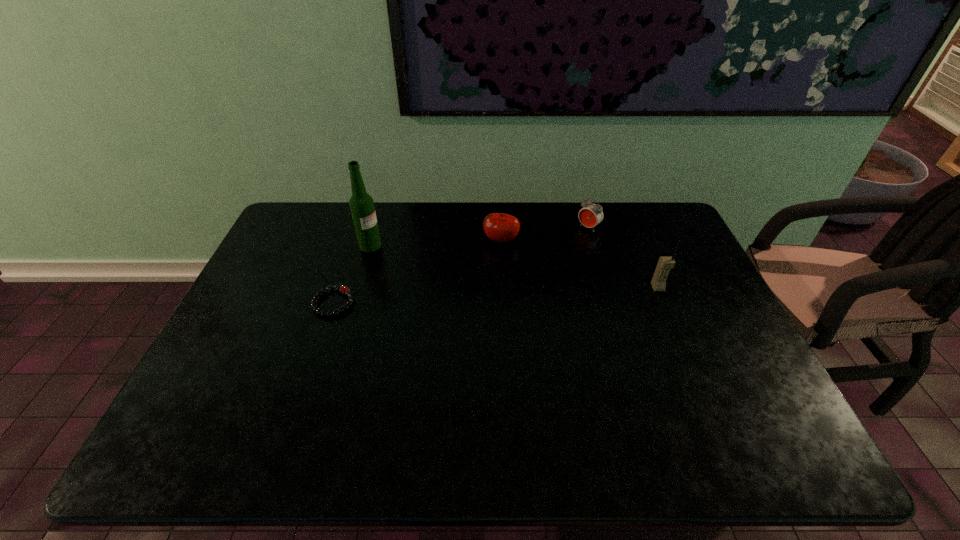
This screenshot has width=960, height=540. Identify the location of vacant area situated 0.070m on the face of the second object from right to left. (571, 242).

Where is `vacant space located on the stem of the apple`? This screenshot has height=540, width=960. vacant space located on the stem of the apple is located at coordinates (491, 260).

In order to click on vacant space located 0.310m on the stem of the apple in this screenshot , I will do `click(464, 315)`.

Where is `free space located on the stem of the apple`? free space located on the stem of the apple is located at coordinates (466, 313).

This screenshot has height=540, width=960. What are the coordinates of `vacant space located 0.160m on the label of the beer bottle` in the screenshot? It's located at (415, 269).

Identify the location of vacant space located on the label of the beer bottle. Image resolution: width=960 pixels, height=540 pixels. (410, 267).

Where is `vacant space situated on the label of the beer bottle`? This screenshot has height=540, width=960. vacant space situated on the label of the beer bottle is located at coordinates (412, 268).

What are the coordinates of `alarm clock that is positioned at the far edge` in the screenshot? It's located at (591, 214).

Where is `apple situated at the far edge`? The height and width of the screenshot is (540, 960). apple situated at the far edge is located at coordinates (499, 227).

The width and height of the screenshot is (960, 540). In order to click on beer bottle that is at the far edge in this screenshot , I will do `click(361, 204)`.